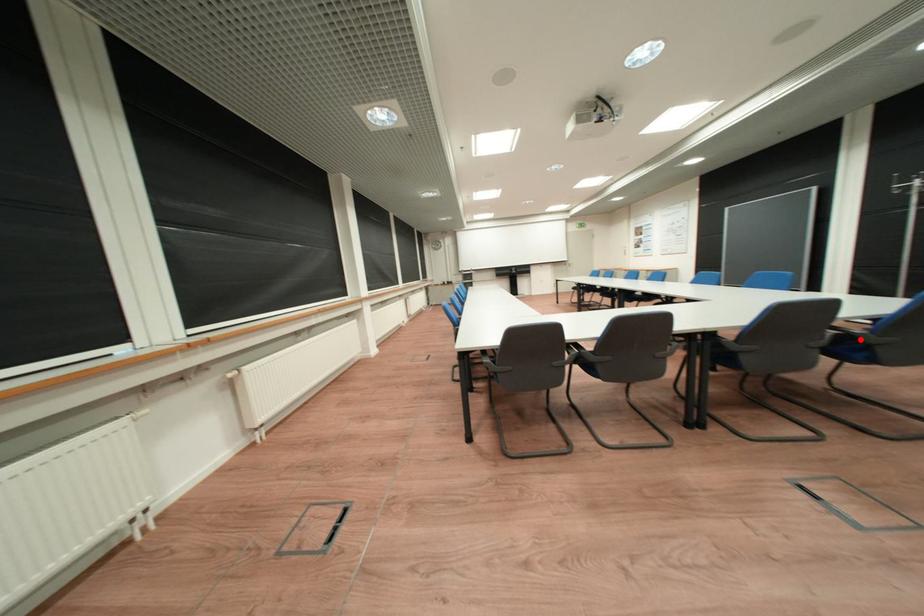
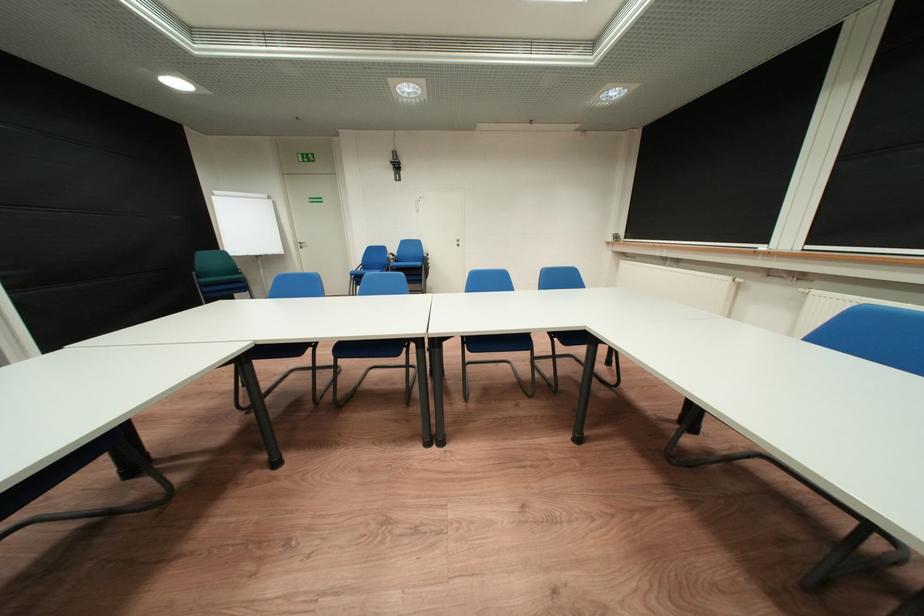
Question: I am providing you with two images of the same scene from different viewpoints. A red point is marked on the first image. Can you still see the location of the red point in image 2?

Choices:
 (A) Yes
 (B) No

Answer: (B)